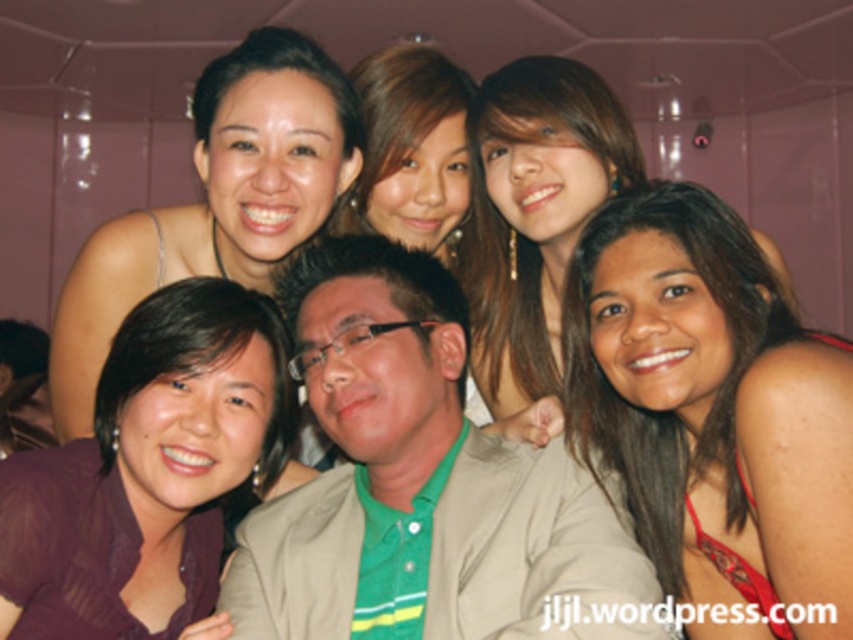
Question: Which of the following is the farthest from the observer?

Choices:
 (A) brown hair at lower right
 (B) green fabric shirt at center
 (C) purple satin blouse at lower left

Answer: (C)

Question: Does purple satin blouse at lower left appear under shiny gold earrings at upper center?

Choices:
 (A) yes
 (B) no

Answer: (A)

Question: Considering the relative positions of brown hair at lower right and shiny gold earrings at upper center in the image provided, where is brown hair at lower right located with respect to shiny gold earrings at upper center?

Choices:
 (A) left
 (B) right

Answer: (B)

Question: Is green fabric shirt at center above matte black hair at upper left?

Choices:
 (A) yes
 (B) no

Answer: (B)

Question: Considering the real-world distances, which object is closest to the green fabric shirt at center?

Choices:
 (A) shiny gold earrings at upper center
 (B) purple satin blouse at lower left

Answer: (B)

Question: Which is nearer to the purple satin blouse at lower left?

Choices:
 (A) matte black hair at upper left
 (B) brown hair at lower right

Answer: (A)